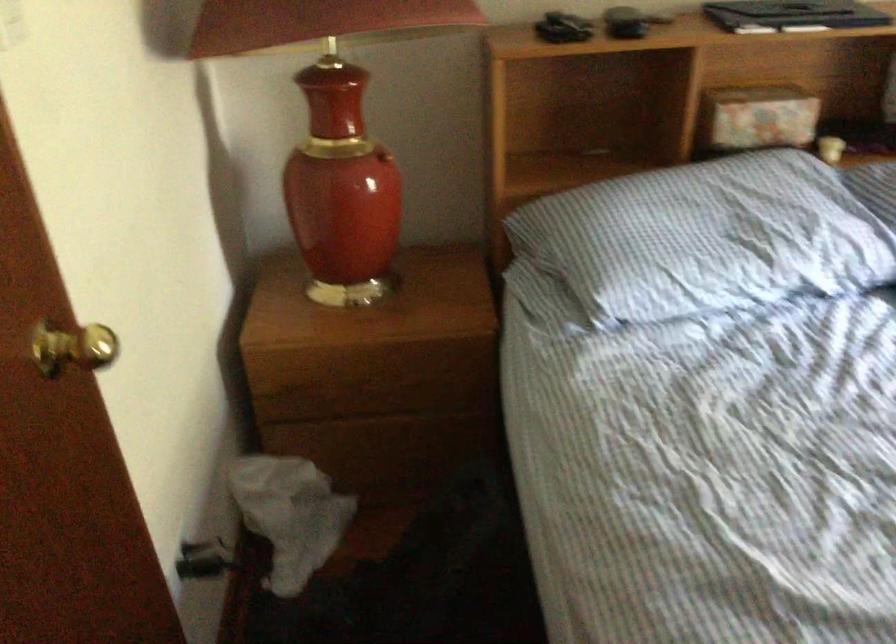
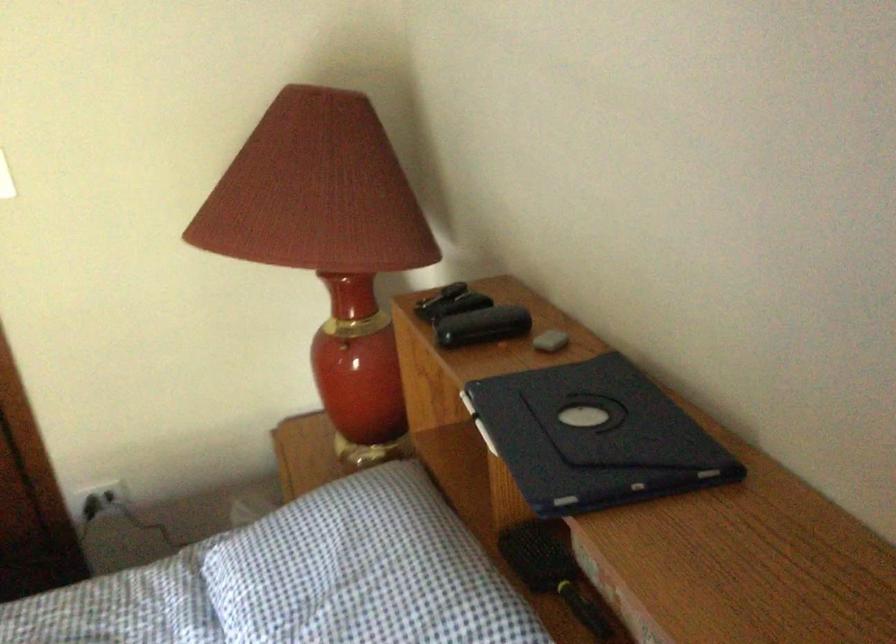
The point at (x=743, y=152) is marked in the first image. Where is the corresponding point in the second image?

(552, 571)